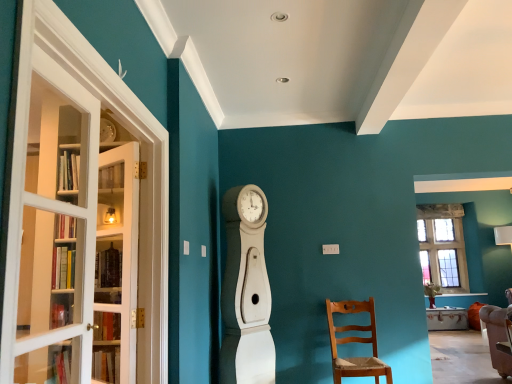
This screenshot has height=384, width=512. Find the location of `light brown wooden chair at lower right`. light brown wooden chair at lower right is located at coordinates (355, 342).

Locate an element on the screen. The width and height of the screenshot is (512, 384). white wood clock at center is located at coordinates coord(246,291).

Where is `white glass door at left`? This screenshot has width=512, height=384. white glass door at left is located at coordinates (116, 265).

Locate an element on the screen. The image size is (512, 384). light brown wooden chair at lower right is located at coordinates (355, 342).

Considering the relative sizes of light brown wooden chair at lower right and white wood clock at center in the image provided, is light brown wooden chair at lower right thinner than white wood clock at center?

Indeed, light brown wooden chair at lower right has a lesser width compared to white wood clock at center.

Is point (372, 298) closer to viewer compared to point (259, 229)?

No, (372, 298) is behind (259, 229).

Does light brown wooden chair at lower right lie behind white wood clock at center?

Yes, the depth of light brown wooden chair at lower right is greater than that of white wood clock at center.

Would you say white glass screen door at left contains white glass door at left?

No, white glass door at left is not inside white glass screen door at left.

Which object is positioned more to the left, white glass screen door at left or white glass door at left?

white glass door at left is more to the left.

Is white glass screen door at left turned away from white glass door at left?

Yes, white glass door at left is at the back of white glass screen door at left.

Image resolution: width=512 pixels, height=384 pixels. Identify the location of door located in front of the light brown wooden chair at lower right. (116, 265).

From the image's perspective, is light brown wooden chair at lower right over white glass door at left?

Actually, light brown wooden chair at lower right appears below white glass door at left in the image.

Which of these two, light brown wooden chair at lower right or white glass door at left, stands taller?

Standing taller between the two is white glass door at left.

Is white glass door at left looking in the opposite direction of white wood clock at center?

Yes, white glass door at left's orientation is away from white wood clock at center.

Looking at their sizes, would you say white glass door at left is wider or thinner than white wood clock at center?

white glass door at left is thinner than white wood clock at center.

Is point (134, 217) behind point (233, 244)?

No, (134, 217) is in front of (233, 244).

Is white wood clock at center directly adjacent to white glass door at left?

No, white wood clock at center is not next to white glass door at left.

Is point (253, 328) behind point (102, 293)?

Yes, point (253, 328) is farther from viewer.

Can you tell me how much white wood clock at center and white glass door at left differ in facing direction?

123 degrees.

Choose the correct answer: Is white glass screen door at left inside light brown wooden chair at lower right or outside it?

white glass screen door at left is outside light brown wooden chair at lower right.

Looking at their sizes, would you say white glass screen door at left is wider or thinner than light brown wooden chair at lower right?

Considering their sizes, white glass screen door at left looks slimmer than light brown wooden chair at lower right.

What's the angular difference between white glass screen door at left and light brown wooden chair at lower right's facing directions?

89.1 degrees separate the facing orientations of white glass screen door at left and light brown wooden chair at lower right.

Is white glass screen door at left further to the viewer compared to light brown wooden chair at lower right?

No, it is not.

Between white glass door at left and white glass screen door at left, which one appears on the left side from the viewer's perspective?

From the viewer's perspective, white glass door at left appears more on the left side.

This screenshot has height=384, width=512. Identify the location of door lying behind the white glass screen door at left. (116, 265).

In terms of width, does white glass door at left look wider or thinner when compared to white glass screen door at left?

In the image, white glass door at left appears to be more narrow than white glass screen door at left.

Does white glass door at left touch white glass screen door at left?

No, white glass door at left is not next to white glass screen door at left.

The width and height of the screenshot is (512, 384). I want to click on chair that appears below the white wood clock at center (from a real-world perspective), so click(355, 342).

The width and height of the screenshot is (512, 384). I want to click on screen door above the white glass door at left (from a real-world perspective), so click(78, 213).

From the image, which object appears to be farther from white glass screen door at left, white glass door at left or white wood clock at center?

white wood clock at center is positioned further to the anchor white glass screen door at left.

Considering their positions, is white glass screen door at left positioned closer to white glass door at left than light brown wooden chair at lower right?

white glass screen door at left lies closer to white glass door at left than the other object.

When comparing their distances from white glass screen door at left, does white glass door at left or light brown wooden chair at lower right seem closer?

white glass door at left.

Looking at the image, which one is located closer to white wood clock at center, white glass door at left or white glass screen door at left?

Among the two, white glass door at left is located nearer to white wood clock at center.

In the scene shown: When comparing their distances from light brown wooden chair at lower right, does white glass door at left or white glass screen door at left seem further?

white glass screen door at left is further to light brown wooden chair at lower right.

Looking at the image, which one is located closer to white glass screen door at left, light brown wooden chair at lower right or white wood clock at center?

The object closer to white glass screen door at left is white wood clock at center.

Based on their spatial positions, is white wood clock at center or light brown wooden chair at lower right further from white glass door at left?

light brown wooden chair at lower right is further to white glass door at left.

Estimate the real-world distances between objects in this image. Which object is further from white glass door at left, white glass screen door at left or white wood clock at center?

white wood clock at center is further to white glass door at left.

Where is `door between white glass screen door at left and light brown wooden chair at lower right in the front-back direction`? This screenshot has height=384, width=512. door between white glass screen door at left and light brown wooden chair at lower right in the front-back direction is located at coordinates (116, 265).

You are a GUI agent. You are given a task and a screenshot of the screen. Output one action in this format:
    pyautogui.click(x=<x>, y=<y>)
    Task: Click on the open between white glass screen door at left and light brown wooden chair at lower right from front to back
    The image size is (512, 384).
    Given the screenshot: What is the action you would take?
    pyautogui.click(x=246, y=291)

I want to click on door between white glass screen door at left and white wood clock at center along the z-axis, so click(116, 265).

Locate an element on the screen. open situated between white glass door at left and light brown wooden chair at lower right from left to right is located at coordinates tap(246, 291).